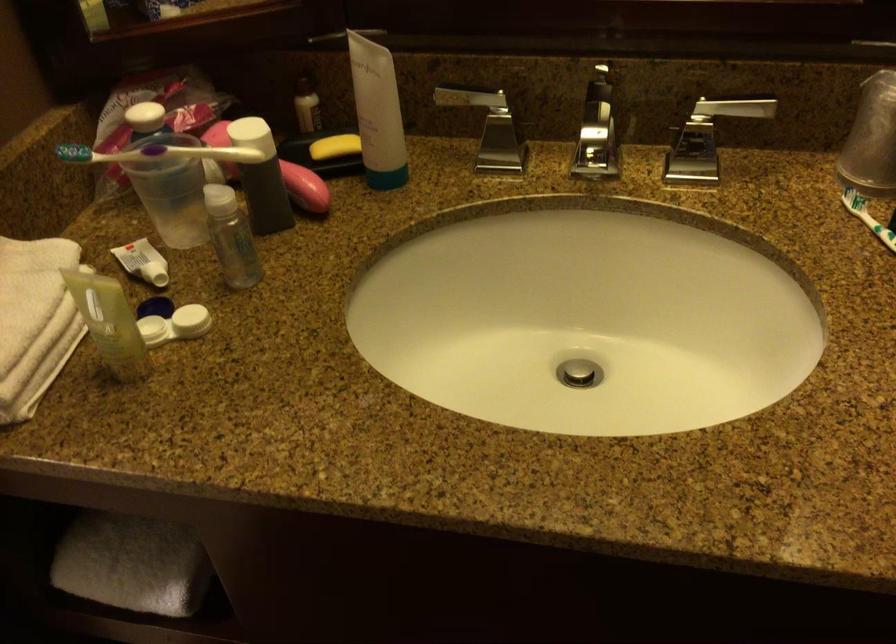
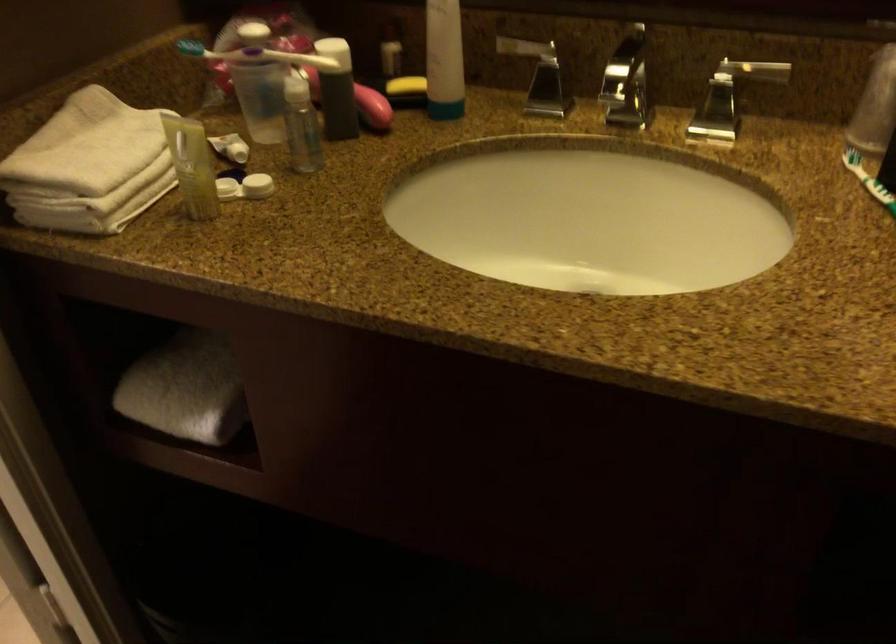
The point at (382, 126) is marked in the first image. Where is the corresponding point in the second image?

(444, 60)